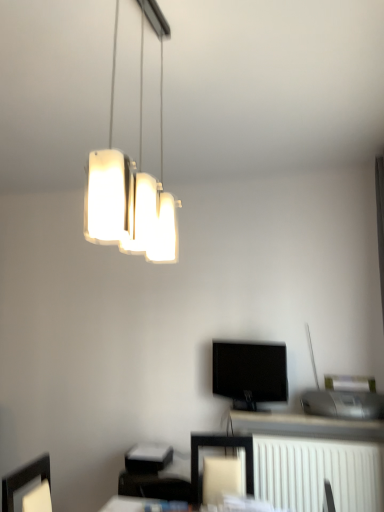
Question: Is white matte lamp at upper center not inside white plastic radiator at lower right?

Choices:
 (A) no
 (B) yes

Answer: (B)

Question: From the image's perspective, is white matte lamp at upper center below white plastic radiator at lower right?

Choices:
 (A) yes
 (B) no

Answer: (B)

Question: From a real-world perspective, is white matte lamp at upper center located beneath white plastic radiator at lower right?

Choices:
 (A) no
 (B) yes

Answer: (A)

Question: Can white plastic radiator at lower right be found inside white matte lamp at upper center?

Choices:
 (A) no
 (B) yes

Answer: (A)

Question: From the image's perspective, is white matte lamp at upper center located above white plastic radiator at lower right?

Choices:
 (A) no
 (B) yes

Answer: (B)

Question: Is white plastic radiator at lower right in front of or behind black glossy tv at center in the image?

Choices:
 (A) behind
 (B) front

Answer: (B)

Question: Based on their sizes in the image, would you say white plastic radiator at lower right is bigger or smaller than black glossy tv at center?

Choices:
 (A) small
 (B) big

Answer: (B)

Question: Visually, is white plastic radiator at lower right positioned to the left or to the right of black glossy tv at center?

Choices:
 (A) left
 (B) right

Answer: (B)

Question: Is white plastic radiator at lower right taller or shorter than black glossy tv at center?

Choices:
 (A) tall
 (B) short

Answer: (A)

Question: In terms of size, does matte black frame at lower center appear bigger or smaller than white matte lamp at upper center?

Choices:
 (A) big
 (B) small

Answer: (A)

Question: Is matte black frame at lower center inside the boundaries of white matte lamp at upper center, or outside?

Choices:
 (A) outside
 (B) inside

Answer: (A)

Question: In the image, is matte black frame at lower center on the left side or the right side of white matte lamp at upper center?

Choices:
 (A) left
 (B) right

Answer: (B)

Question: Considering the positions of matte black frame at lower center and white matte lamp at upper center in the image, is matte black frame at lower center wider or thinner than white matte lamp at upper center?

Choices:
 (A) thin
 (B) wide

Answer: (B)

Question: Considering the positions of white plastic radiator at lower right and matte black frame at lower center in the image, is white plastic radiator at lower right taller or shorter than matte black frame at lower center?

Choices:
 (A) short
 (B) tall

Answer: (B)

Question: From a real-world perspective, is white plastic radiator at lower right positioned above or below matte black frame at lower center?

Choices:
 (A) above
 (B) below

Answer: (B)